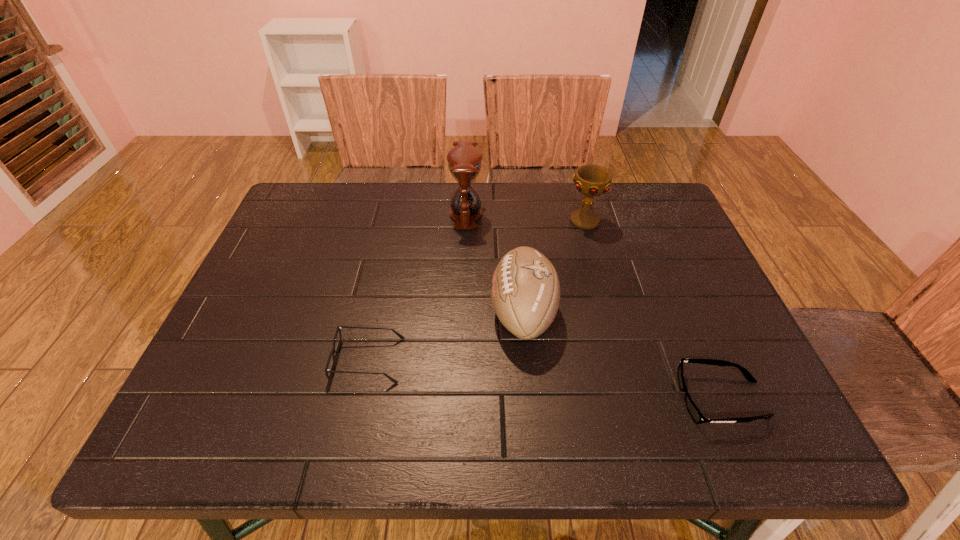
Identify the location of vacant region located 0.320m on the laces of the third object from left to right. 351,313.

You are a GUI agent. You are given a task and a screenshot of the screen. Output one action in this format:
    pyautogui.click(x=<x>, y=<y>)
    Task: Click on the free space located with the lenses facing outward on the leftmost object
    The width and height of the screenshot is (960, 540).
    Given the screenshot: What is the action you would take?
    pyautogui.click(x=435, y=360)

At what (x,y) coordinates should I click in order to perform the action: click on free space located on the front-facing side of the rightmost object. Please return your answer as a coordinate pair (x, y). Image resolution: width=960 pixels, height=540 pixels. Looking at the image, I should click on (592, 399).

Locate an element on the screen. The image size is (960, 540). vacant region located 0.360m on the front-facing side of the rightmost object is located at coordinates (495, 399).

Image resolution: width=960 pixels, height=540 pixels. Identify the location of free region located on the front-facing side of the rightmost object. (546, 399).

At what (x,y) coordinates should I click in order to perform the action: click on hourglass that is positioned at the far edge. Please return your answer as a coordinate pair (x, y). The height and width of the screenshot is (540, 960). Looking at the image, I should click on (464, 160).

You are a GUI agent. You are given a task and a screenshot of the screen. Output one action in this format:
    pyautogui.click(x=<x>, y=<y>)
    Task: Click on the chalice located in the far edge section of the desktop
    The image size is (960, 540).
    Given the screenshot: What is the action you would take?
    pyautogui.click(x=591, y=180)

At what (x,y) coordinates should I click in order to perform the action: click on object at the near edge. Please return your answer as a coordinate pair (x, y). This screenshot has height=540, width=960. Looking at the image, I should click on (697, 416).

At what (x,y) coordinates should I click in order to perform the action: click on object positioned at the right edge. Please return your answer as a coordinate pair (x, y). Image resolution: width=960 pixels, height=540 pixels. Looking at the image, I should click on (697, 416).

Where is `object at the near right corner`? object at the near right corner is located at coordinates (697, 416).